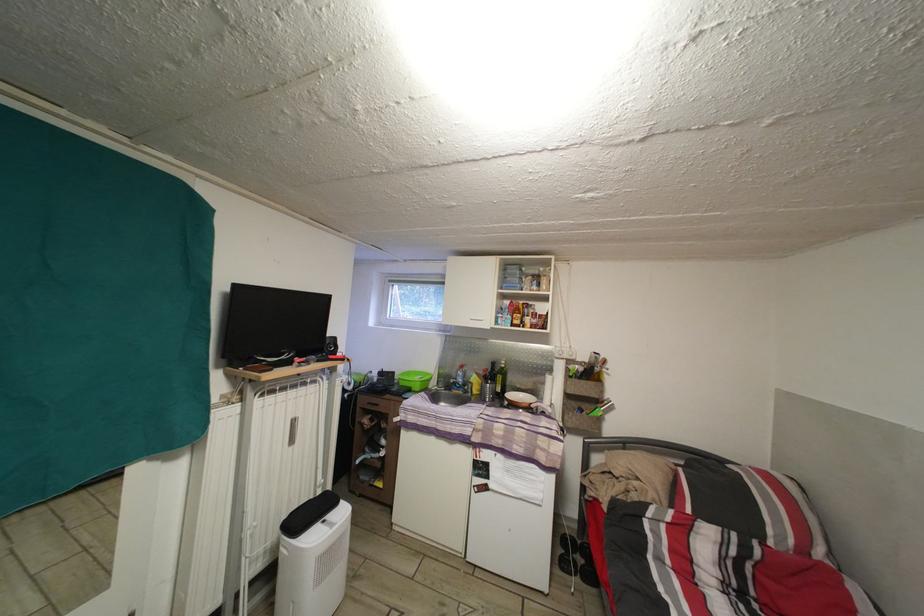
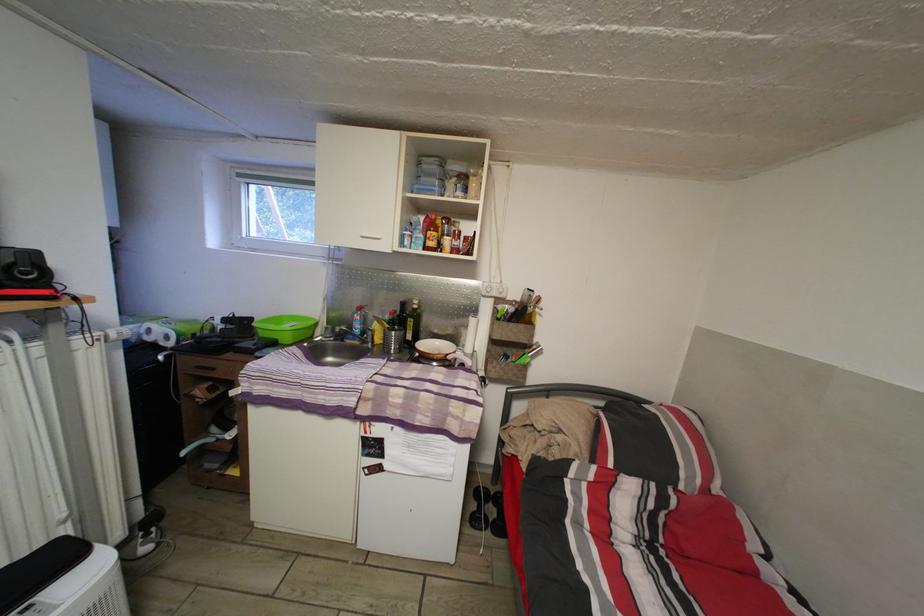
In the second image, find the point that corresponds to [506,384] in the first image.

(418, 329)